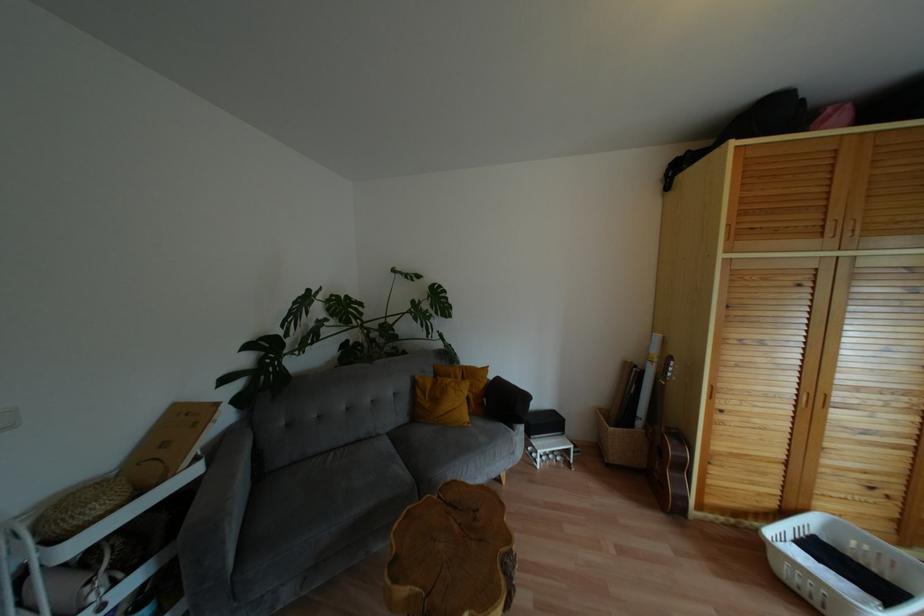
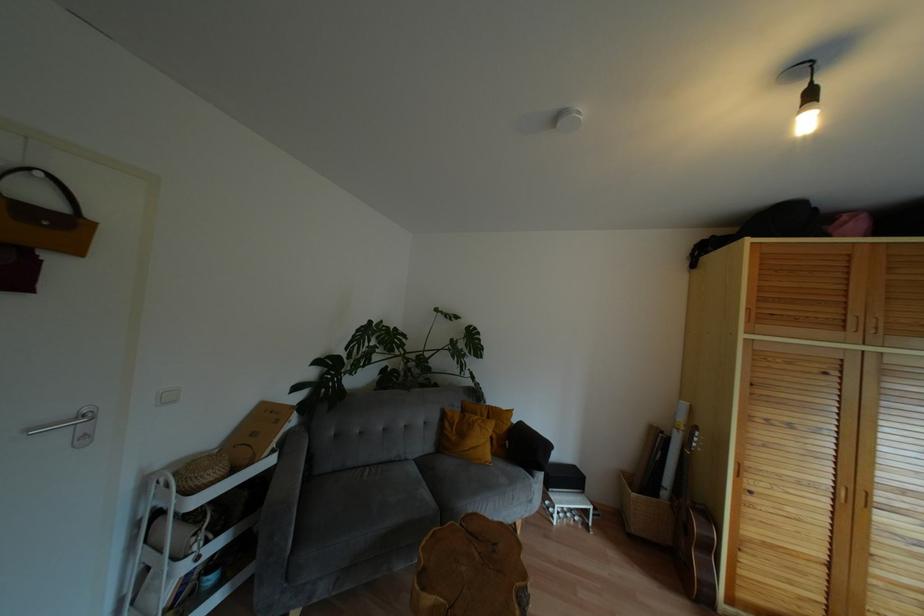
Question: Based on the continuous images, in which direction is the camera rotating? Reply with the corresponding letter.

Choices:
 (A) Left
 (B) Right
 (C) Up
 (D) Down

Answer: (C)